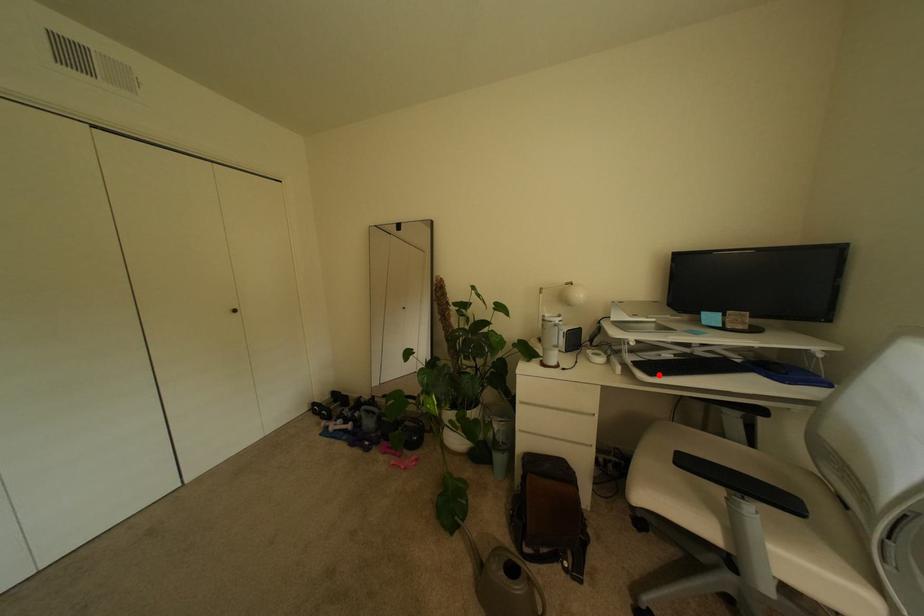
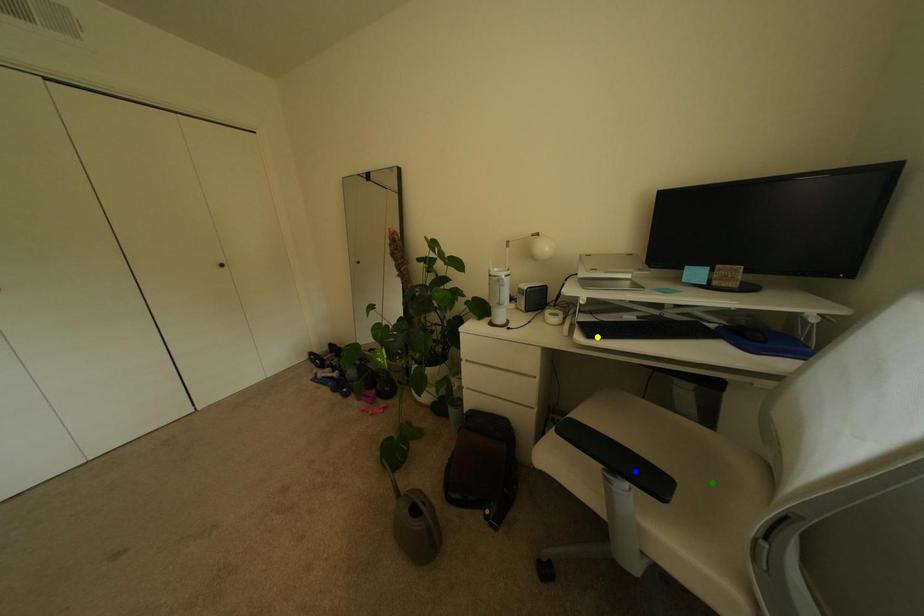
Question: I am providing you with two images of the same scene from different viewpoints. A red point is marked on the first image. You are given multiple points on the second image. Which point in image 2 represents the same 3d spot as the red point in image 1?

Choices:
 (A) yellow point
 (B) green point
 (C) blue point

Answer: (A)